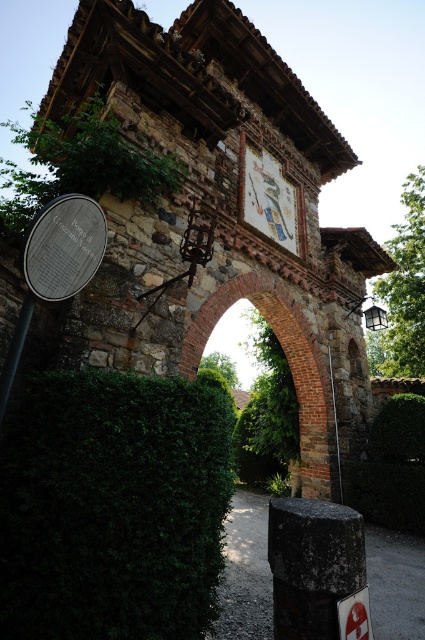
Question: Is brick archway at center thinner than smooth stone post at center?

Choices:
 (A) no
 (B) yes

Answer: (A)

Question: Is the position of metallic circular sign at left more distant than that of silver metallic sign at left?

Choices:
 (A) yes
 (B) no

Answer: (B)

Question: Which object is closer to the camera taking this photo?

Choices:
 (A) smooth stone post at center
 (B) black matte pole at lower left

Answer: (B)

Question: Which object is closer to the camera taking this photo?

Choices:
 (A) metallic circular sign at left
 (B) smooth stone post at center

Answer: (A)

Question: Can you confirm if silver metallic sign at left is positioned above black matte pole at lower left?

Choices:
 (A) no
 (B) yes

Answer: (B)

Question: Which point appears closest to the camera in this image?

Choices:
 (A) (288, 353)
 (B) (57, 241)

Answer: (B)